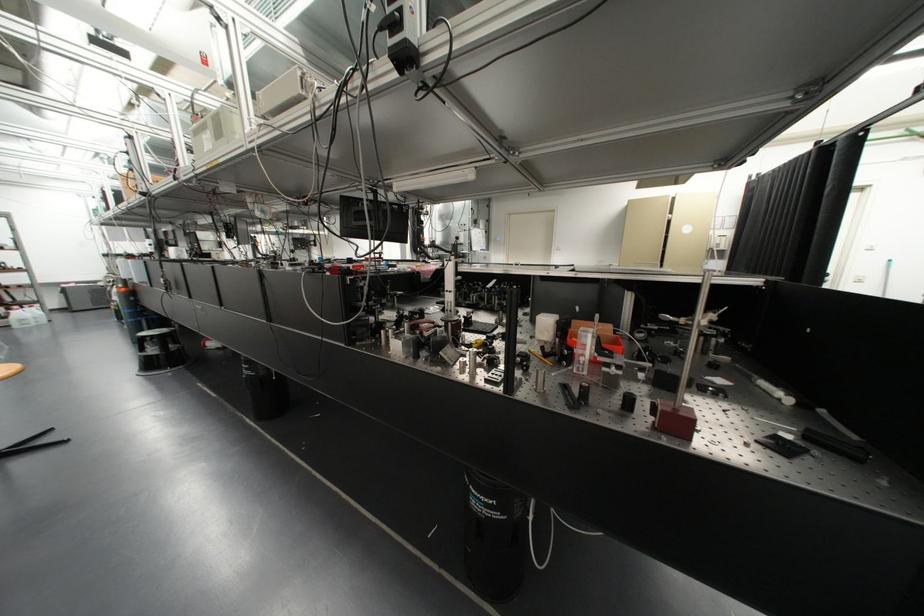
What do you see at coordinates (807, 91) in the screenshot? This screenshot has width=924, height=616. I see `a silver adjustment knob` at bounding box center [807, 91].